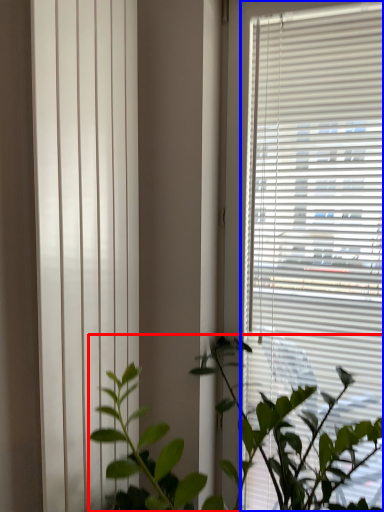
Question: Which object appears closest to the camera in this image, houseplant (highlighted by a red box) or window blind (highlighted by a blue box)?

Choices:
 (A) houseplant
 (B) window blind

Answer: (A)